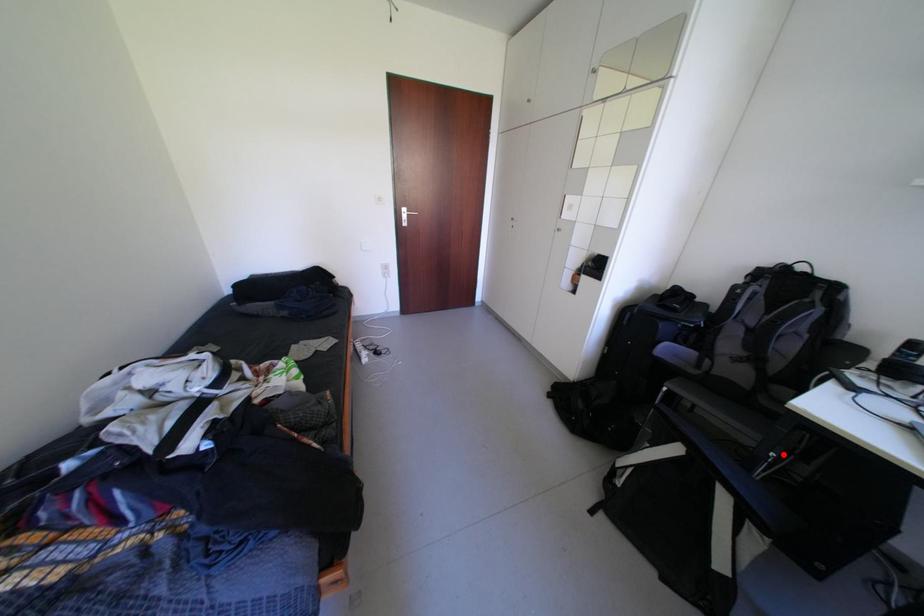
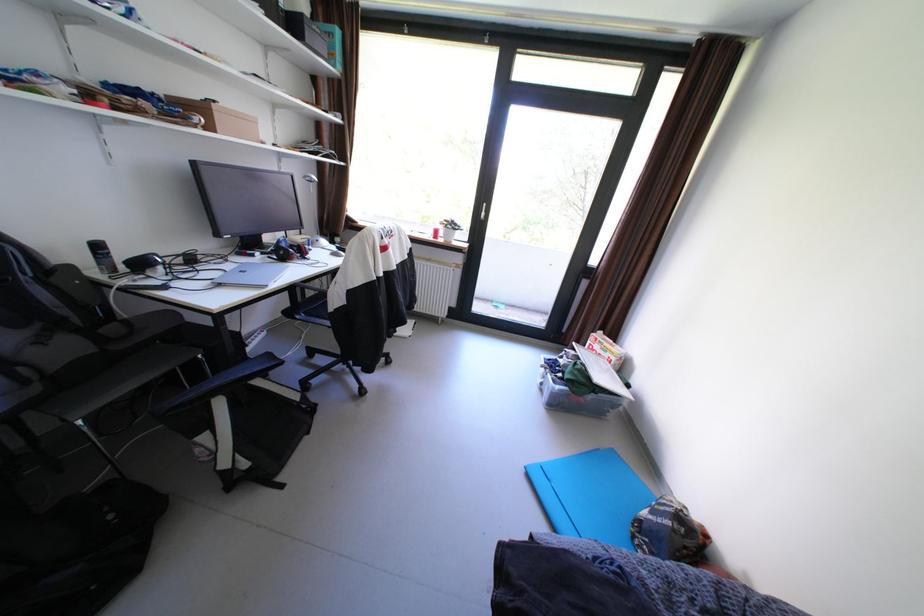
Locate, in the second image, the point that corresponds to the highlighted location in the first image.

(210, 357)